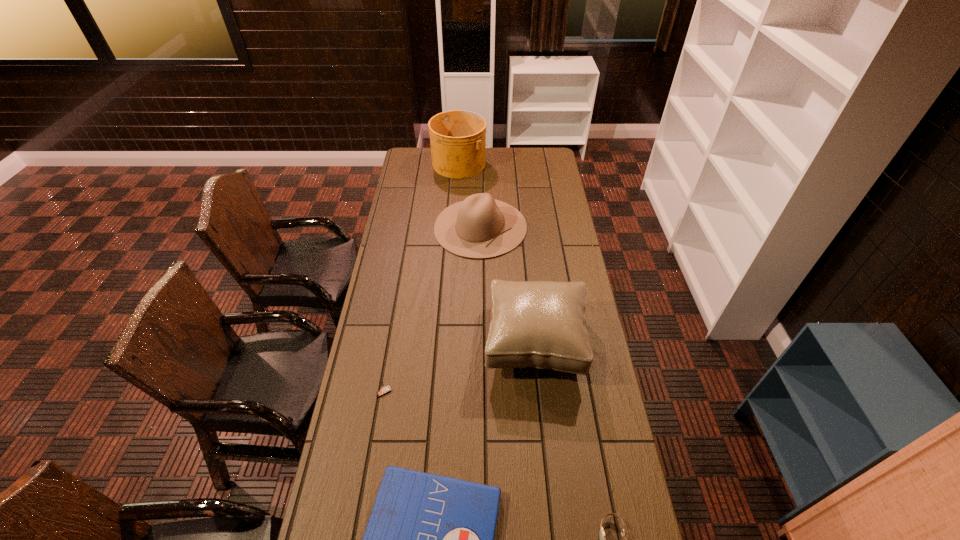
Locate an element on the screen. unoccupied position between the cushion and the matchbox is located at coordinates (460, 366).

This screenshot has height=540, width=960. Identify the location of object that can be found as the third closest to the first-aid kit. (541, 324).

Select which object appears as the closest to the third shortest object. Please provide its 2D coordinates. Your answer should be formatted as a tuple, i.e. [(x, y)], where the tuple contains the x and y coordinates of a point satisfying the conditions above.

[(429, 539)]